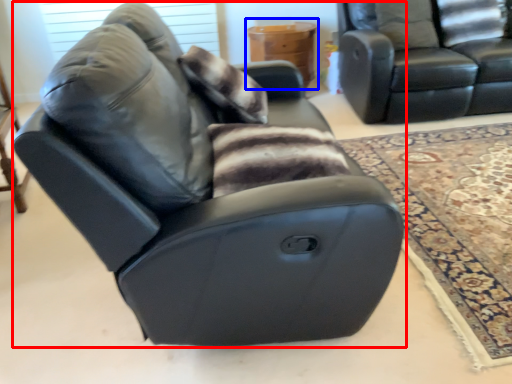
Question: Which of the following is the closest to the observer, chair (highlighted by a red box) or table (highlighted by a blue box)?

Choices:
 (A) chair
 (B) table

Answer: (A)